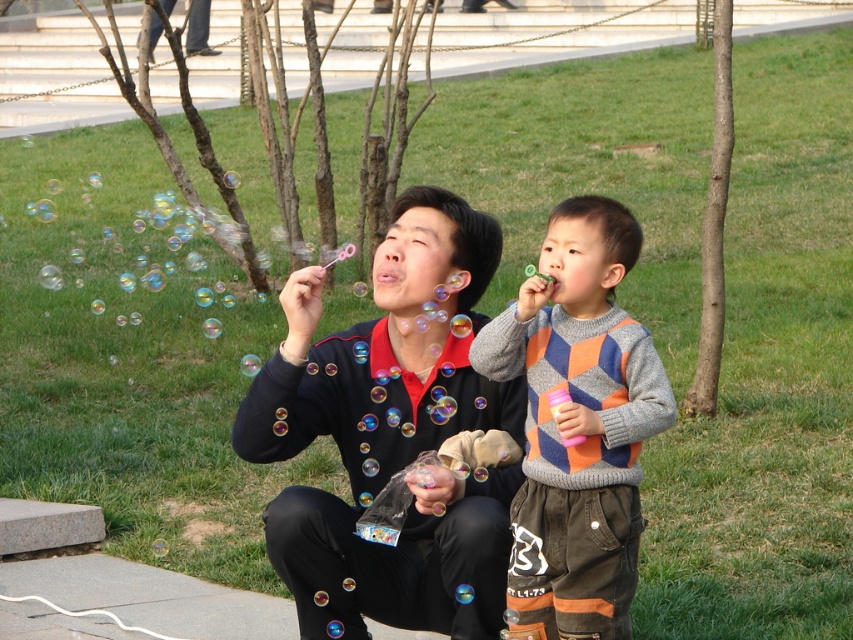
Question: Which object appears farthest from the camera in this image?

Choices:
 (A) green grass at lower center
 (B) matte black sweater at center

Answer: (A)

Question: Estimate the real-world distances between objects in this image. Which object is closer to the green grass at lower center?

Choices:
 (A) knitted sweater at center
 (B) matte black sweater at center

Answer: (B)

Question: Can you confirm if knitted sweater at center is positioned above green grass at lower center?

Choices:
 (A) no
 (B) yes

Answer: (A)

Question: Can you confirm if matte black sweater at center is positioned below green grass at lower center?

Choices:
 (A) yes
 (B) no

Answer: (A)

Question: Which point appears closest to the camera in this image?

Choices:
 (A) (471, 384)
 (B) (380, 33)
 (C) (540, 538)

Answer: (C)

Question: Can you confirm if matte black sweater at center is wider than green grass at lower center?

Choices:
 (A) no
 (B) yes

Answer: (A)